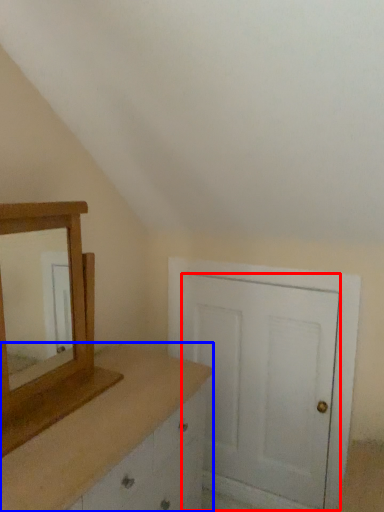
Question: Which object appears closest to the camera in this image, door (highlighted by a red box) or chest of drawers (highlighted by a blue box)?

Choices:
 (A) door
 (B) chest of drawers

Answer: (B)